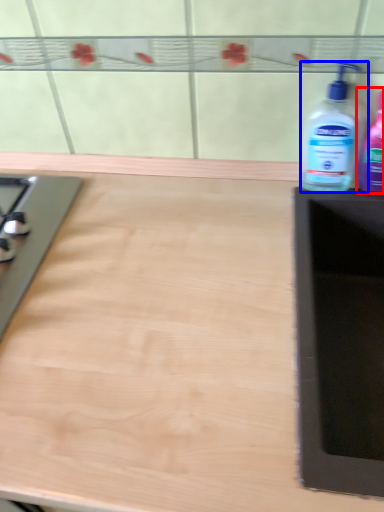
Question: Which point is further to the camera, bottle (highlighted by a red box) or bottle (highlighted by a blue box)?

Choices:
 (A) bottle
 (B) bottle

Answer: (B)